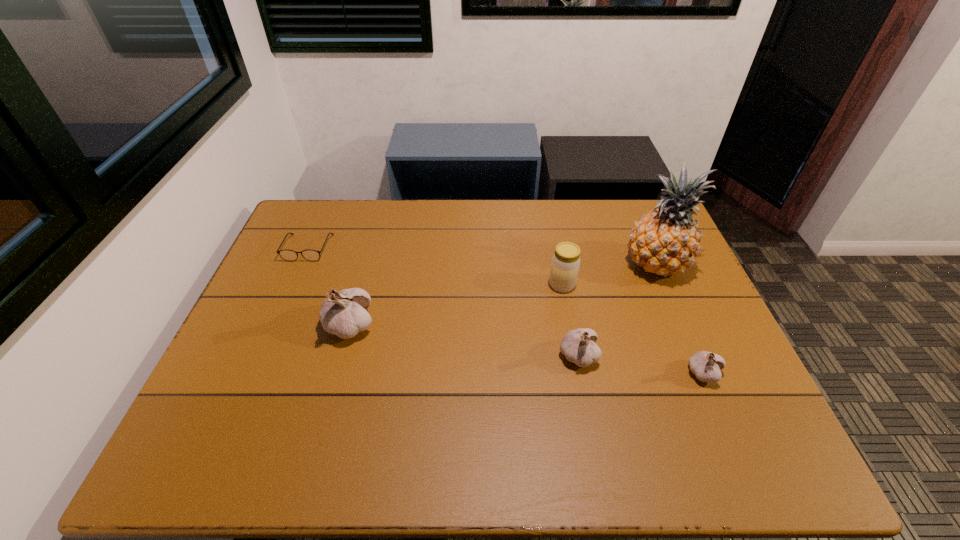
Where is `vacant space located 0.190m on the right of the second garlic from left to right`? Image resolution: width=960 pixels, height=540 pixels. vacant space located 0.190m on the right of the second garlic from left to right is located at coordinates (671, 356).

Find the location of a particular element. This screenshot has height=540, width=960. free space located 0.370m on the back of the shortest garlic is located at coordinates (657, 262).

At what (x,y) coordinates should I click in order to perform the action: click on vacant space located 0.060m on the back of the pineapple. Please return your answer as a coordinate pair (x, y). The width and height of the screenshot is (960, 540). Looking at the image, I should click on (642, 232).

Identify the location of vacant space located on the front-facing side of the leftmost object. tap(255, 368).

Identify the location of vacant point located 0.050m on the right of the jar. (592, 285).

Locate an element on the screen. Image resolution: width=960 pixels, height=540 pixels. object present at the far edge is located at coordinates (288, 255).

Locate an element on the screen. object present at the left edge is located at coordinates (288, 255).

This screenshot has width=960, height=540. I want to click on garlic that is at the right edge, so click(x=706, y=366).

Image resolution: width=960 pixels, height=540 pixels. In order to click on pineapple that is at the right edge in this screenshot , I will do `click(665, 241)`.

The image size is (960, 540). Find the location of `object situated at the far left corner`. object situated at the far left corner is located at coordinates (288, 255).